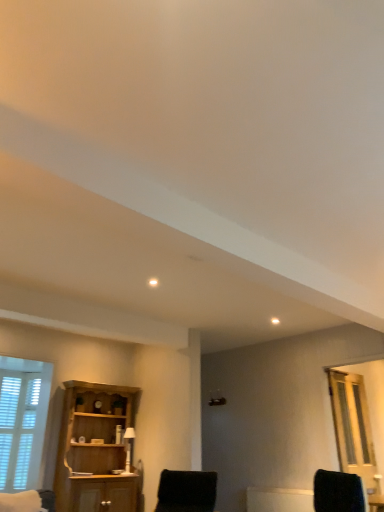
Question: Does wooden cabinet at left lie in front of white ceramic table lamp at center?

Choices:
 (A) yes
 (B) no

Answer: (A)

Question: Can you confirm if wooden cabinet at left is taller than white ceramic table lamp at center?

Choices:
 (A) no
 (B) yes

Answer: (B)

Question: Is wooden cabinet at left smaller than white ceramic table lamp at center?

Choices:
 (A) yes
 (B) no

Answer: (B)

Question: Considering the relative sizes of wooden cabinet at left and white ceramic table lamp at center in the image provided, is wooden cabinet at left thinner than white ceramic table lamp at center?

Choices:
 (A) yes
 (B) no

Answer: (B)

Question: Can you confirm if wooden cabinet at left is wider than white ceramic table lamp at center?

Choices:
 (A) yes
 (B) no

Answer: (A)

Question: Is wooden cabinet at left located outside white ceramic table lamp at center?

Choices:
 (A) no
 (B) yes

Answer: (B)

Question: Is clear glass door at right closer to the viewer compared to wooden cabinet at left?

Choices:
 (A) yes
 (B) no

Answer: (B)

Question: Is the depth of clear glass door at right greater than that of wooden cabinet at left?

Choices:
 (A) no
 (B) yes

Answer: (B)

Question: From the image's perspective, is clear glass door at right below wooden cabinet at left?

Choices:
 (A) no
 (B) yes

Answer: (A)

Question: Does clear glass door at right touch wooden cabinet at left?

Choices:
 (A) no
 (B) yes

Answer: (A)

Question: Is wooden cabinet at left a part of clear glass door at right?

Choices:
 (A) yes
 (B) no

Answer: (B)

Question: Is clear glass door at right not within wooden cabinet at left?

Choices:
 (A) no
 (B) yes

Answer: (B)

Question: Is clear glass door at right inside black fuzzy chair at lower center?

Choices:
 (A) yes
 (B) no

Answer: (B)